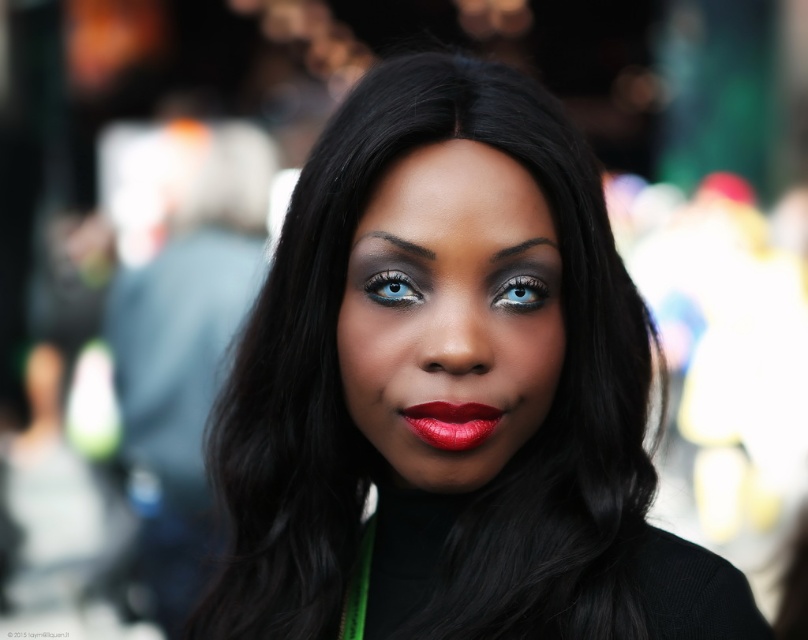
Question: Can you confirm if matte black hair at center is positioned to the right of matte black face at center?

Choices:
 (A) no
 (B) yes

Answer: (B)

Question: Which of the following is the closest to the observer?

Choices:
 (A) shiny matte lipstick at center
 (B) blue glossy eye at upper center
 (C) matte black hair at center

Answer: (C)

Question: Which point appears closest to the camera in this image?

Choices:
 (A) (549, 241)
 (B) (409, 516)
 (C) (434, 404)

Answer: (C)

Question: Does matte black face at center appear on the right side of blue matte eye at upper center?

Choices:
 (A) yes
 (B) no

Answer: (B)

Question: Which point is closer to the camera?

Choices:
 (A) shiny matte lipstick at center
 (B) blue glossy eye at upper center
 (C) blue matte eye at upper center

Answer: (A)

Question: Does shiny matte lipstick at center come in front of blue glossy eye at upper center?

Choices:
 (A) no
 (B) yes

Answer: (B)